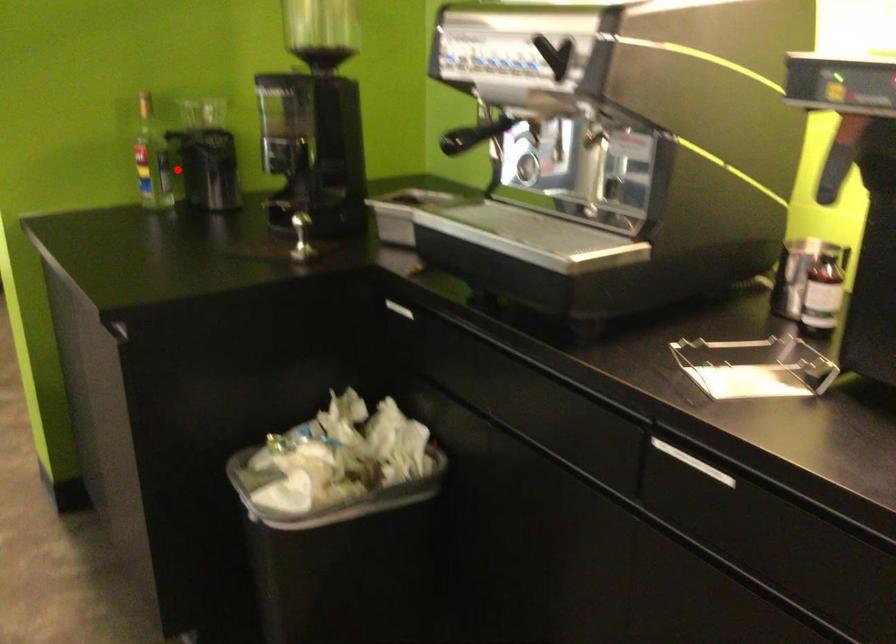
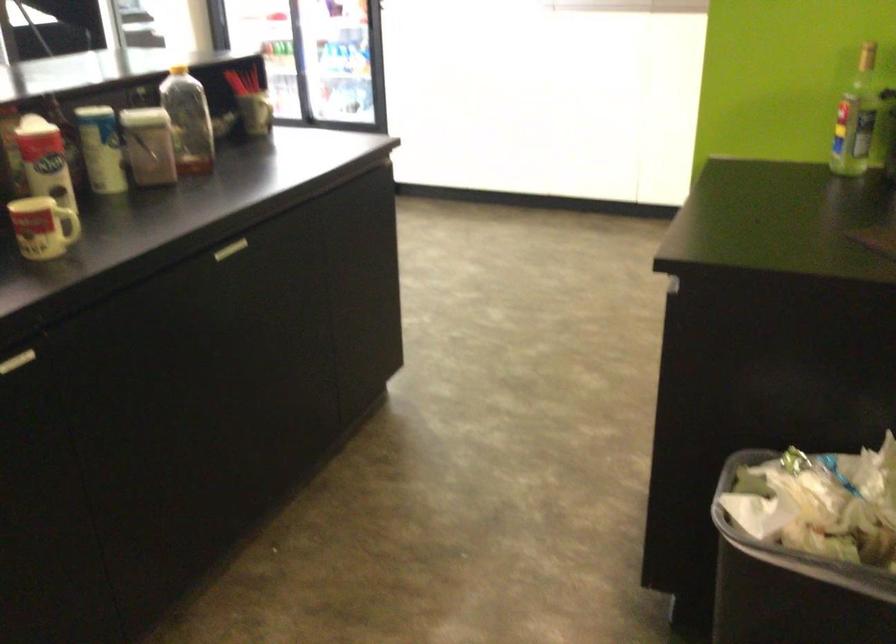
Where in the second image is the point corresponding to the highlighted location from the first image?

(856, 118)